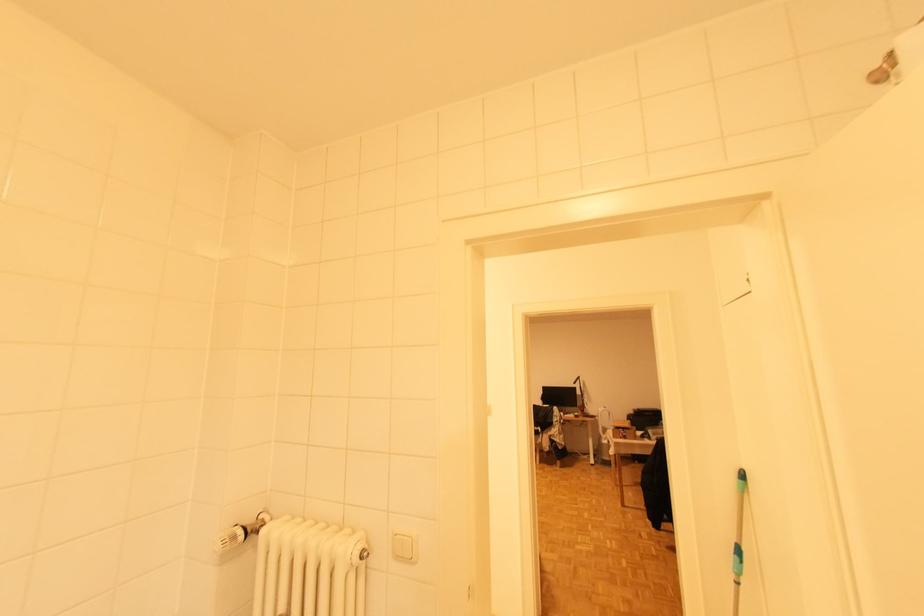
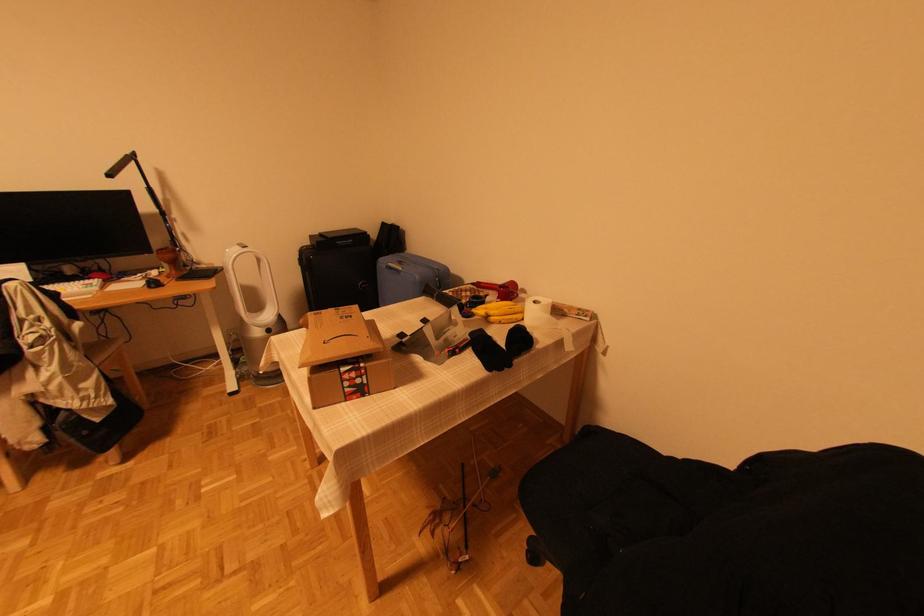
Find the pixel in the second image that matches [579,416] in the first image.

(156, 284)